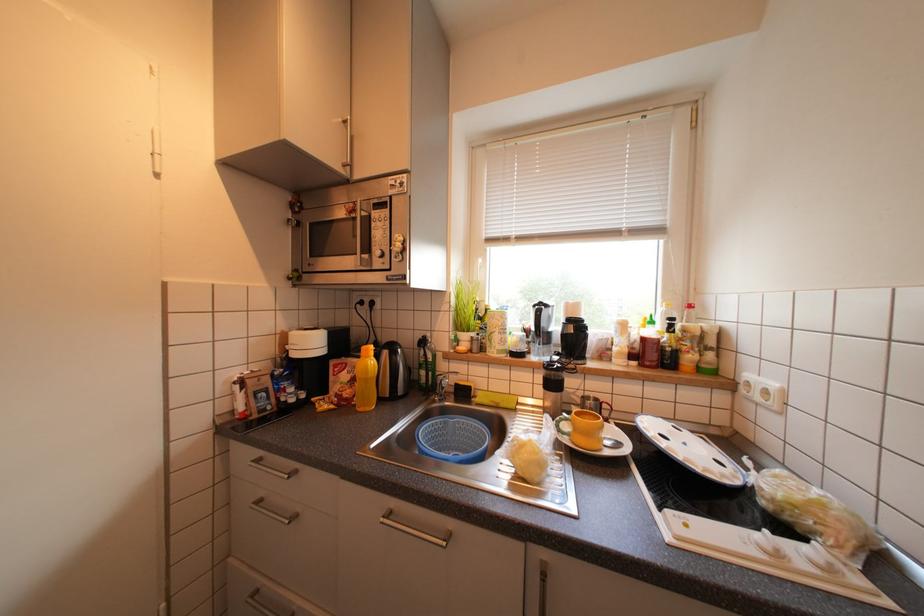
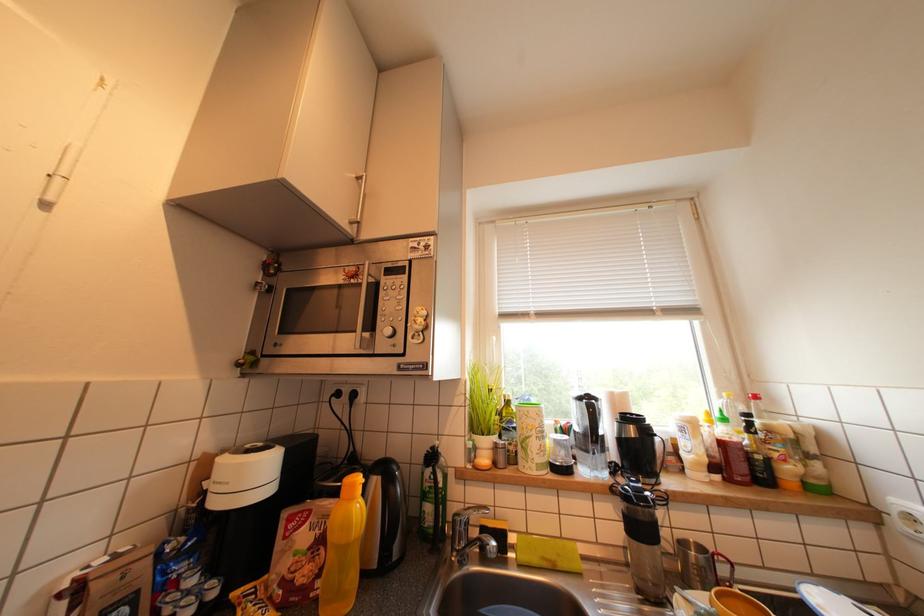
What movement of the cameraman would produce the second image?

The cameraman walked toward left, forward.